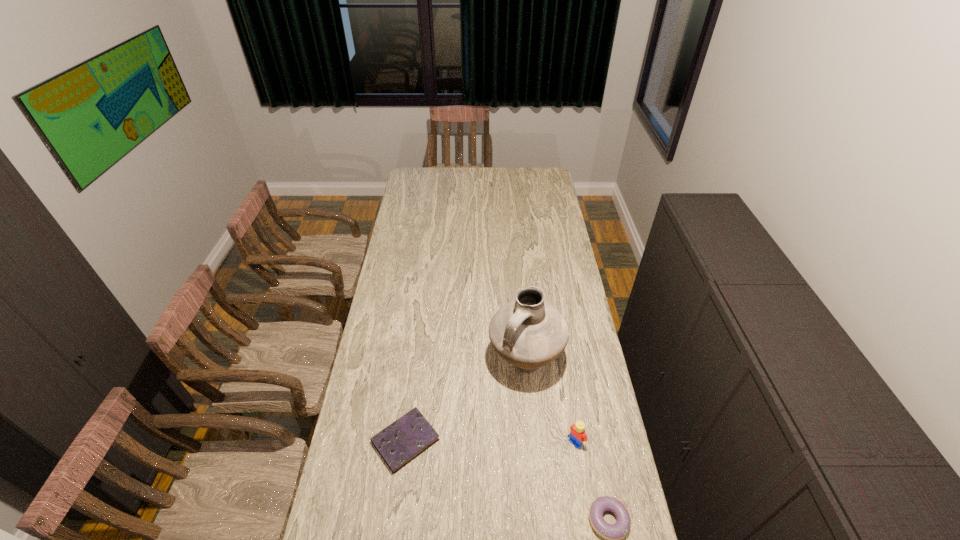
Locate an element on the screen. This screenshot has width=960, height=540. free space on the desktop that is between the diary and the nearest object and is positioned on the handle side of the tallest object is located at coordinates pyautogui.click(x=485, y=472).

This screenshot has height=540, width=960. In order to click on free space on the desktop that is between the diary and the third tallest object and is positioned on the face of the third shortest object in this screenshot , I will do `click(531, 490)`.